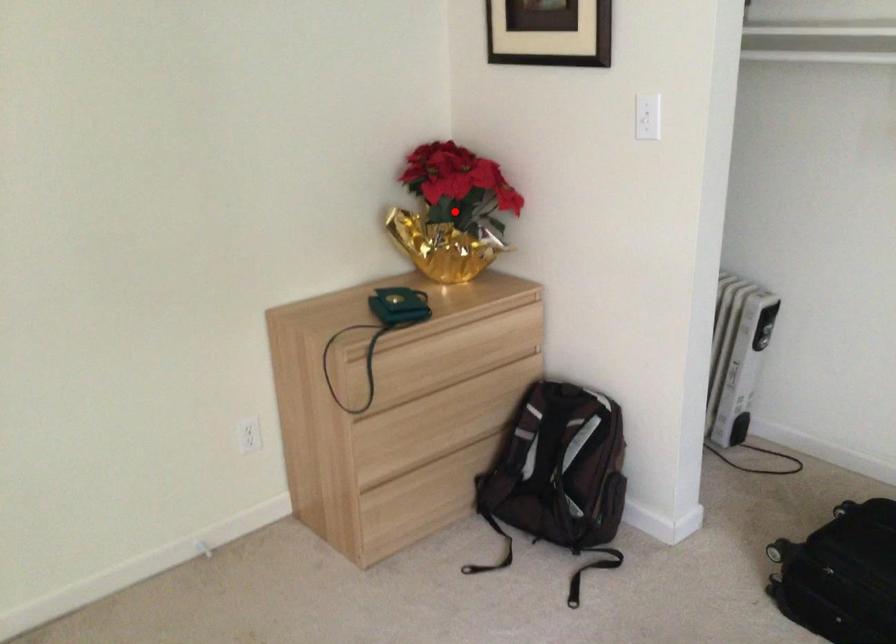
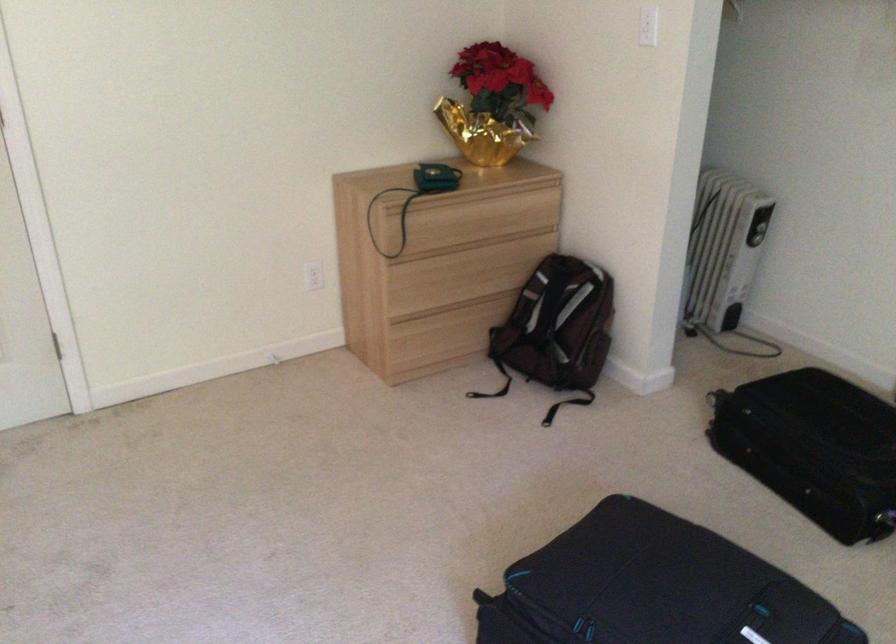
Where in the second image is the point corresponding to the highlighted location from the first image?

(493, 104)